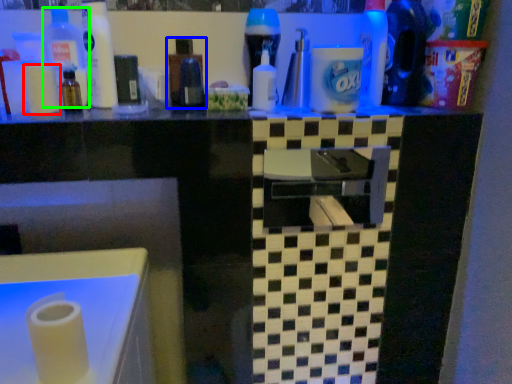
Question: Which object is positioned farthest from toilet paper (highlighted by a red box)? Select from bottle (highlighted by a blue box) and bottle (highlighted by a green box).

Choices:
 (A) bottle
 (B) bottle

Answer: (A)